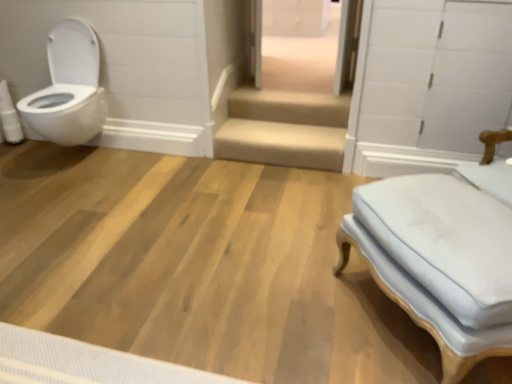
Question: Based on their positions, is white glossy toilet at left located to the left or right of white fabric ottoman at right?

Choices:
 (A) right
 (B) left

Answer: (B)

Question: Is white glossy toilet at left in front of or behind white fabric ottoman at right in the image?

Choices:
 (A) front
 (B) behind

Answer: (B)

Question: Estimate the real-world distances between objects in this image. Which object is farther from the white glossy drawer at upper center?

Choices:
 (A) white fabric ottoman at right
 (B) white glossy toilet at left

Answer: (A)

Question: Which of these objects is positioned farthest from the white glossy toilet at left?

Choices:
 (A) white fabric ottoman at right
 (B) white glossy drawer at upper center

Answer: (B)